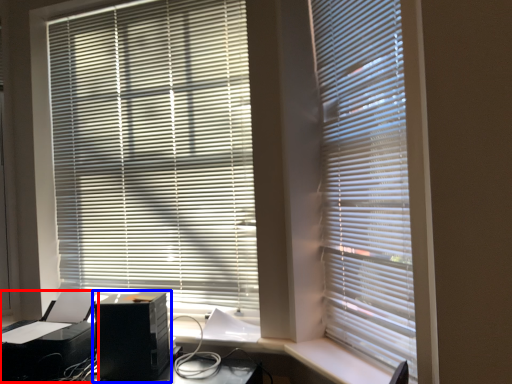
Question: Which object appears farthest to the camera in this image, printer (highlighted by a red box) or computer tower (highlighted by a blue box)?

Choices:
 (A) printer
 (B) computer tower

Answer: (A)